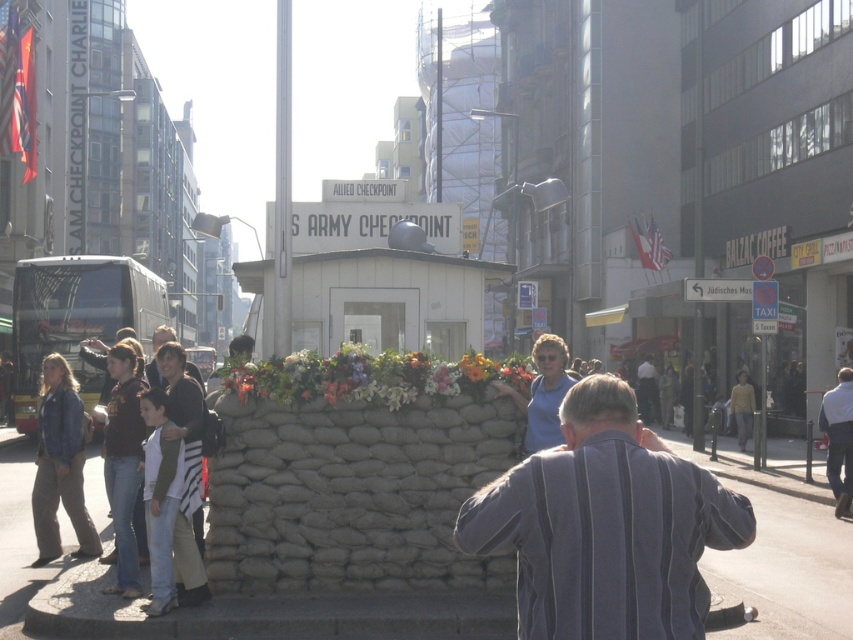
What do you see at coordinates (606, 525) in the screenshot? The width and height of the screenshot is (853, 640). I see `striped fabric shirt at center` at bounding box center [606, 525].

Identify the location of striped fabric shirt at center. This screenshot has height=640, width=853. (606, 525).

Image resolution: width=853 pixels, height=640 pixels. Identify the location of striped fabric shirt at center. (606, 525).

Who is more distant from viewer, (740, 540) or (811, 548)?

Point (811, 548)

Does striped fabric shirt at center appear on the right side of gray concrete pavement at center?

Indeed, striped fabric shirt at center is positioned on the right side of gray concrete pavement at center.

Locate an element on the screen. This screenshot has height=640, width=853. striped fabric shirt at center is located at coordinates (606, 525).

Which is in front, point (767, 563) or point (80, 372)?

Point (767, 563)

This screenshot has width=853, height=640. In order to click on gray concrete pavement at center in this screenshot , I will do `click(793, 563)`.

Is point (57, 563) in front of point (42, 310)?

Yes, point (57, 563) is closer to viewer.

At what (x,y) coordinates should I click in order to perform the action: click on gray concrete pavement at center. Please return your answer as a coordinate pair (x, y). Image resolution: width=853 pixels, height=640 pixels. Looking at the image, I should click on (793, 563).